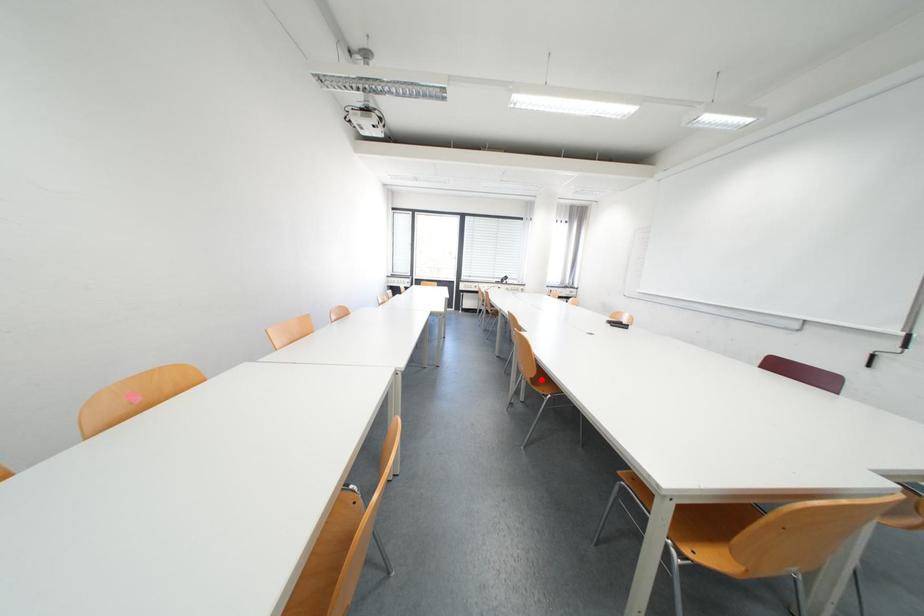
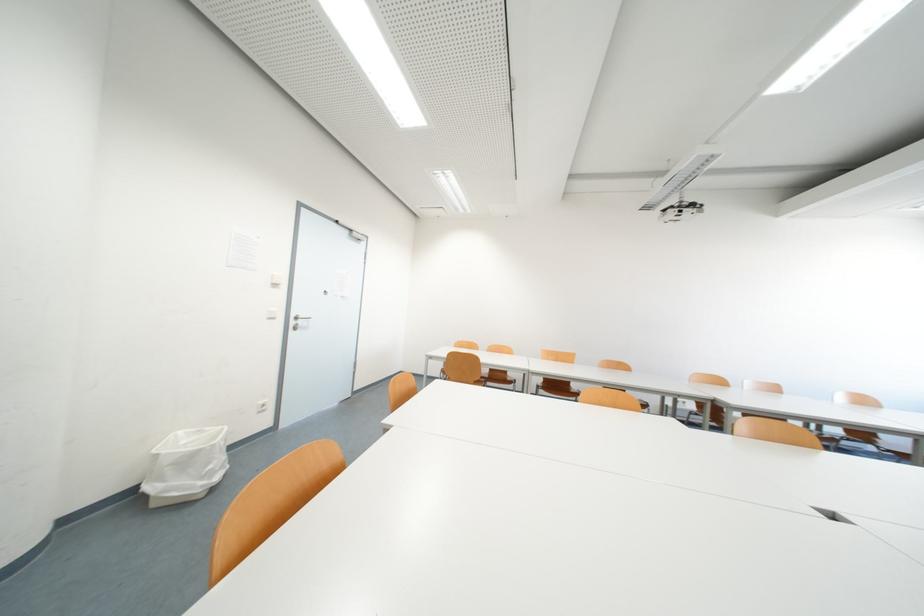
Question: I am providing you with two images of the same scene from different viewpoints. A red point is marked on the first image. At the location where the point appears in image 1, is it still visible in image 2?

Choices:
 (A) Yes
 (B) No

Answer: (B)